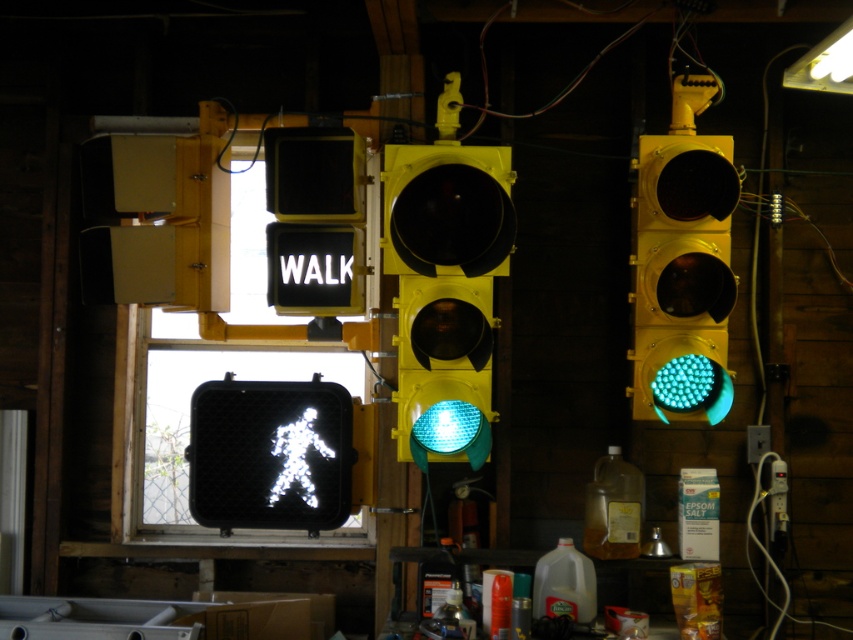
Question: Estimate the real-world distances between objects in this image. Which object is farther from the yellow matte traffic light at center?

Choices:
 (A) white plastic traffic light at upper left
 (B) white plastic sign at upper center
 (C) green matte traffic light at right

Answer: (A)

Question: Among these objects, which one is nearest to the camera?

Choices:
 (A) white plastic traffic light at upper left
 (B) green matte traffic light at right
 (C) yellow matte traffic light at center
 (D) white plastic sign at upper center

Answer: (C)

Question: From the image, what is the correct spatial relationship of green matte traffic light at right in relation to white plastic traffic light at upper left?

Choices:
 (A) left
 (B) right

Answer: (B)

Question: Is green matte traffic light at right to the right of white plastic sign at upper center from the viewer's perspective?

Choices:
 (A) no
 (B) yes

Answer: (B)

Question: Is yellow matte traffic light at center bigger than white plastic traffic light at upper left?

Choices:
 (A) yes
 (B) no

Answer: (A)

Question: Estimate the real-world distances between objects in this image. Which object is farther from the white plastic traffic light at upper left?

Choices:
 (A) yellow matte traffic light at center
 (B) green matte traffic light at right
 (C) white plastic sign at upper center

Answer: (B)